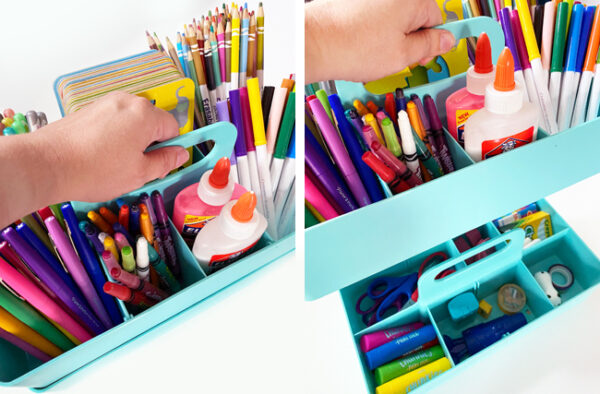
Locate an element on the screen. This screenshot has height=394, width=600. pens is located at coordinates (10, 111), (21, 121), (35, 119), (6, 122), (5, 131).